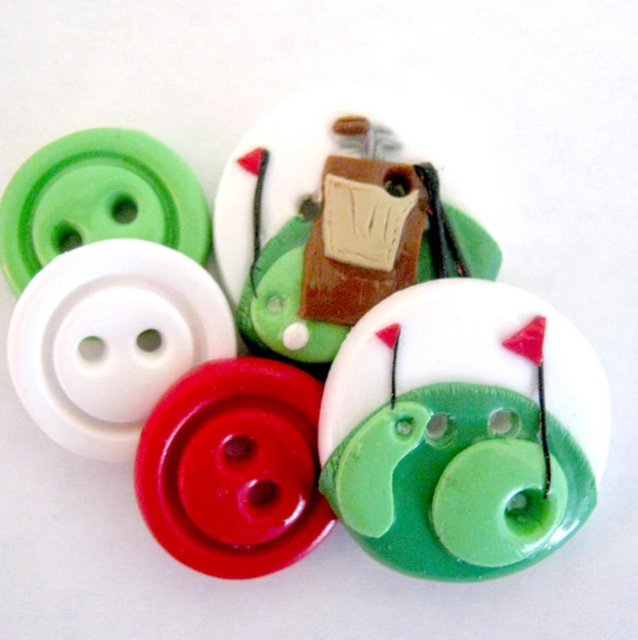
Is green glossy button at upper center above matte brown wooden block at center?

Incorrect, green glossy button at upper center is not positioned above matte brown wooden block at center.

Who is shorter, green glossy button at upper center or matte brown wooden block at center?

matte brown wooden block at center

Is point (112, 316) farther from viewer compared to point (426, 168)?

No, it is not.

Locate an element on the screen. green glossy button at upper center is located at coordinates tap(323, 362).

Does green glossy button at upper center have a smaller size compared to green glossy button at center?

No, green glossy button at upper center is not smaller than green glossy button at center.

Is point (160, 540) less distant than point (343, 420)?

That is True.

Describe the element at coordinates (323, 362) in the screenshot. This screenshot has height=640, width=638. I see `green glossy button at upper center` at that location.

Locate an element on the screen. Image resolution: width=638 pixels, height=640 pixels. green glossy button at upper center is located at coordinates (x=323, y=362).

Which is more to the left, green glossy button at center or matte brown wooden block at center?

matte brown wooden block at center is more to the left.

Who is more forward, [466,378] or [454,198]?

Point [466,378]

Is point (561, 317) positioned after point (276, 182)?

No, it is not.

The image size is (638, 640). Identify the location of green glossy button at center. (461, 432).